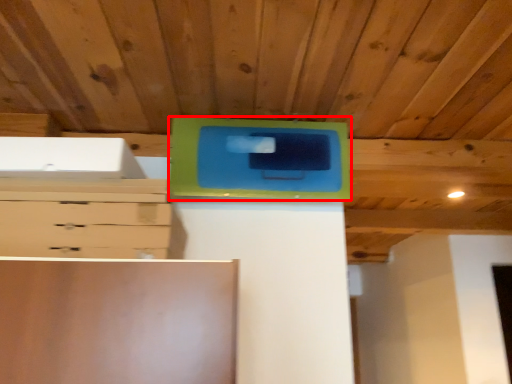
Question: Considering the relative positions of cabinetry (annotated by the red box) and chest of drawers in the image provided, where is cabinetry (annotated by the red box) located with respect to the staircase?

Choices:
 (A) left
 (B) right

Answer: (B)